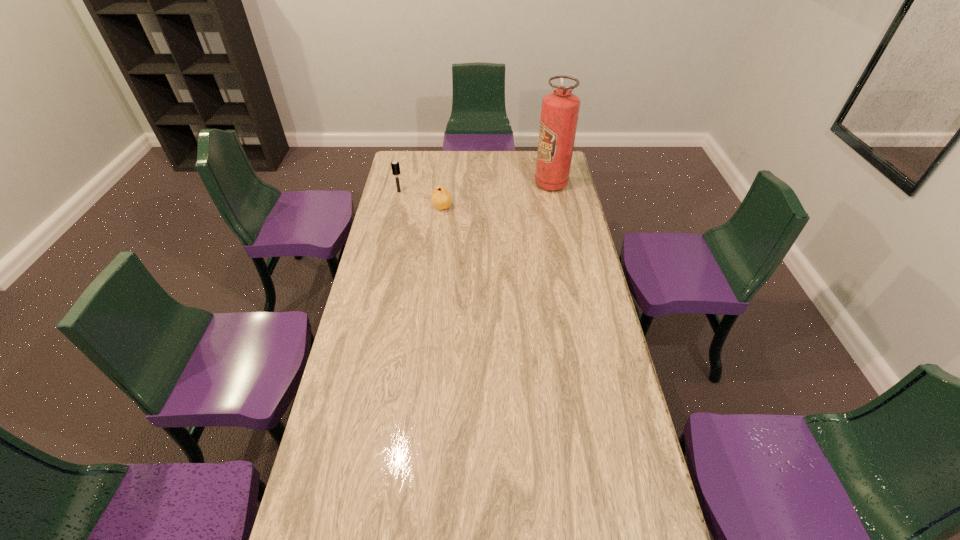
The height and width of the screenshot is (540, 960). I want to click on the tallest object, so click(560, 109).

In order to click on fire extinguisher in this screenshot , I will do `click(560, 109)`.

Find the location of `hairbrush`. hairbrush is located at coordinates (395, 165).

Identify the location of the leftmost object. This screenshot has height=540, width=960. (395, 165).

Find the location of a particular element. Image resolution: width=960 pixels, height=540 pixels. the nearest object is located at coordinates (441, 198).

Identify the location of the shortest object. (441, 198).

Identify the location of vacant space located on the label side of the rightmost object. The width and height of the screenshot is (960, 540). tap(471, 184).

The height and width of the screenshot is (540, 960). Find the location of `vacant space located 0.340m on the label side of the rightmost object`. vacant space located 0.340m on the label side of the rightmost object is located at coordinates (466, 184).

Where is `free space located 0.220m on the label side of the rightmost object`? Image resolution: width=960 pixels, height=540 pixels. free space located 0.220m on the label side of the rightmost object is located at coordinates (490, 184).

Identify the location of vacant space located 0.330m on the right of the leftmost object. (471, 192).